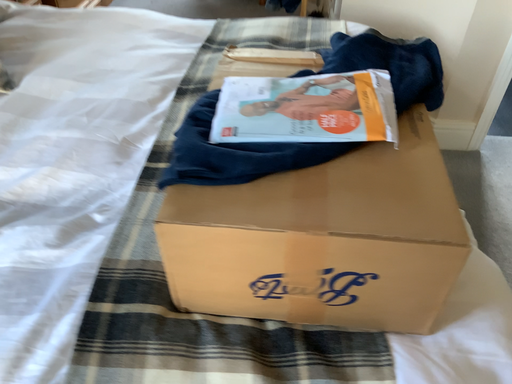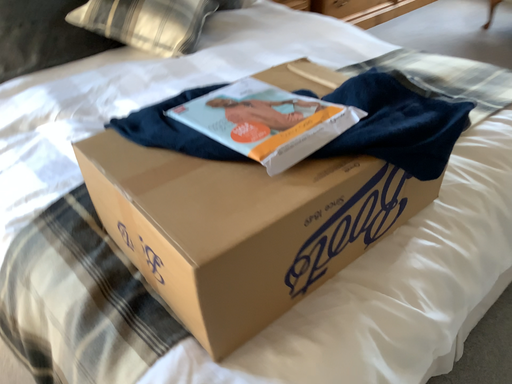
Question: How did the camera likely rotate when shooting the video?

Choices:
 (A) rotated right
 (B) rotated left

Answer: (B)